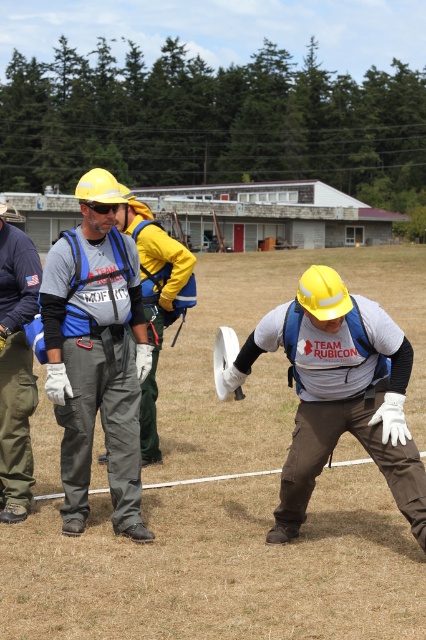
Question: Does matte gray jumpsuit at center appear on the left side of matte gray shirt at center?

Choices:
 (A) no
 (B) yes

Answer: (B)

Question: From the image, what is the correct spatial relationship of blue-gray uniform at center in relation to white fabric glove at lower center?

Choices:
 (A) right
 (B) left

Answer: (B)

Question: Is matte gray shirt at center to the right of white fabric glove at lower center from the viewer's perspective?

Choices:
 (A) yes
 (B) no

Answer: (A)

Question: Among these objects, which one is nearest to the camera?

Choices:
 (A) matte gray jumpsuit at center
 (B) white fabric glove at lower center
 (C) matte gray shirt at center

Answer: (C)

Question: Which object is closer to the camera taking this photo?

Choices:
 (A) white fabric glove at lower center
 (B) matte gray jumpsuit at center
 (C) matte gray shirt at center

Answer: (C)

Question: Which of these objects is positioned farthest from the matte gray shirt at center?

Choices:
 (A) matte gray jumpsuit at center
 (B) matte blue vest at center
 (C) white fabric glove at lower center

Answer: (B)